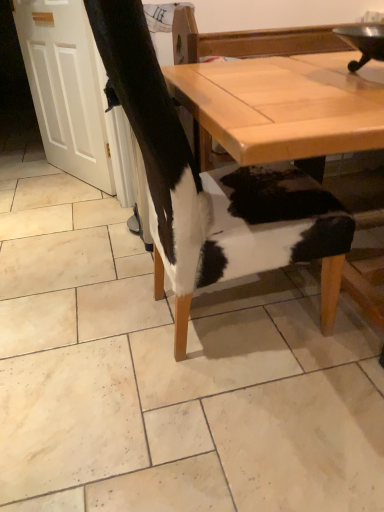
Locate an element on the screen. The width and height of the screenshot is (384, 512). free point in front of cowhide at center is located at coordinates (107, 271).